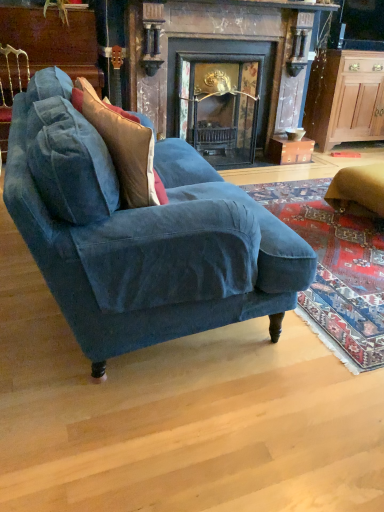
The width and height of the screenshot is (384, 512). What do you see at coordinates (221, 70) in the screenshot? I see `dark wood fireplace at center` at bounding box center [221, 70].

Locate an element on the screen. This screenshot has height=512, width=384. dark wood fireplace at center is located at coordinates (221, 70).

This screenshot has height=512, width=384. What do you see at coordinates (123, 147) in the screenshot?
I see `velvet cushion at left` at bounding box center [123, 147].

In order to face velvet blue couch at center, should I rotate leftwards or rightwards?

You should rotate left by 7.170 degrees.

What is the approximate width of velvet blue armchair at upper left?

It is 16.53 inches.

The width and height of the screenshot is (384, 512). Find the location of `velvet blue armchair at upper left`. velvet blue armchair at upper left is located at coordinates (10, 92).

Locate an element on the screen. The image size is (384, 512). dark wood fireplace at center is located at coordinates (221, 70).

Would you say velvet blue armchair at upper left is part of wooden cabinet at right's contents?

Definitely not — velvet blue armchair at upper left is not inside wooden cabinet at right.

From the picture: Can you confirm if wooden cabinet at right is positioned to the right of velvet blue armchair at upper left?

Correct, you'll find wooden cabinet at right to the right of velvet blue armchair at upper left.

Is wooden cabinet at right thinner than velvet blue armchair at upper left?

In fact, wooden cabinet at right might be wider than velvet blue armchair at upper left.

The width and height of the screenshot is (384, 512). I want to click on chair on the left of wooden cabinet at right, so click(x=10, y=92).

Considering the sizes of objects velvet cushion at left and velvet blue armchair at upper left in the image provided, who is bigger, velvet cushion at left or velvet blue armchair at upper left?

Bigger between the two is velvet blue armchair at upper left.

Could velvet blue armchair at upper left be considered to be inside velvet cushion at left?

No.

Is velvet blue armchair at upper left at the back of velvet cushion at left?

No, velvet cushion at left's orientation is not away from velvet blue armchair at upper left.

Which is behind, velvet cushion at left or dark wood fireplace at center?

Positioned behind is dark wood fireplace at center.

From the image's perspective, which object appears higher, velvet cushion at left or dark wood fireplace at center?

dark wood fireplace at center appears higher in the image.

Is velvet cushion at left positioned far away from dark wood fireplace at center?

Yes, velvet cushion at left and dark wood fireplace at center are located far from each other.

From a real-world perspective, does velvet cushion at left stand above dark wood fireplace at center?

Indeed, from a real-world perspective, velvet cushion at left stands above dark wood fireplace at center.

Is velvet blue armchair at upper left behind velvet cushion at left?

That is True.

From a real-world perspective, which is physically above, velvet blue armchair at upper left or velvet cushion at left?

From a 3D spatial view, velvet cushion at left is above.

In the scene shown: Does velvet blue armchair at upper left have a greater width compared to velvet cushion at left?

Correct, the width of velvet blue armchair at upper left exceeds that of velvet cushion at left.

From the image's perspective, does velvet blue armchair at upper left appear lower than dark wood fireplace at center?

Correct, velvet blue armchair at upper left appears lower than dark wood fireplace at center in the image.

From a real-world perspective, between velvet blue armchair at upper left and dark wood fireplace at center, who is vertically higher?

dark wood fireplace at center.

Consider the image. Is velvet blue armchair at upper left situated inside dark wood fireplace at center or outside?

velvet blue armchair at upper left cannot be found inside dark wood fireplace at center.

Is point (28, 62) farther from camera compared to point (191, 113)?

No, (28, 62) is in front of (191, 113).

Does point (21, 131) come behind point (3, 140)?

That is False.

Locate an element on the screen. Image resolution: width=384 pixels, height=512 pixels. chair behind the velvet blue couch at center is located at coordinates (10, 92).

From the picture: How different are the orientations of velvet blue couch at center and velvet blue armchair at upper left in degrees?

The angle between the facing direction of velvet blue couch at center and the facing direction of velvet blue armchair at upper left is 88.4 degrees.

Who is shorter, velvet blue couch at center or velvet blue armchair at upper left?

velvet blue armchair at upper left.

From the picture: Considering the relative sizes of wooden cabinet at right and velvet blue couch at center in the image provided, is wooden cabinet at right bigger than velvet blue couch at center?

Incorrect, wooden cabinet at right is not larger than velvet blue couch at center.

Is wooden cabinet at right to the left or to the right of velvet blue couch at center in the image?

From the image, it's evident that wooden cabinet at right is to the right of velvet blue couch at center.

Is wooden cabinet at right wider than velvet blue couch at center?

In fact, wooden cabinet at right might be narrower than velvet blue couch at center.

The height and width of the screenshot is (512, 384). I want to click on cabinetry that is above the velvet blue armchair at upper left (from the image's perspective), so click(x=345, y=98).

Where is `chair lying behind the velvet cushion at left`? chair lying behind the velvet cushion at left is located at coordinates (10, 92).

When comparing their distances from dark wood fireplace at center, does velvet blue armchair at upper left or wooden cabinet at right seem further?

velvet blue armchair at upper left is further to dark wood fireplace at center.

Based on the photo, which object lies nearer to the anchor point wooden cabinet at right, velvet blue couch at center or dark wood fireplace at center?

dark wood fireplace at center is closer to wooden cabinet at right.

From the image, which object appears to be farther from velvet blue couch at center, wooden cabinet at right or dark wood fireplace at center?

wooden cabinet at right is positioned further to the anchor velvet blue couch at center.

When comparing their distances from wooden cabinet at right, does velvet cushion at left or velvet blue couch at center seem closer?

Based on the image, velvet blue couch at center appears to be nearer to wooden cabinet at right.

Considering their positions, is velvet cushion at left positioned further to dark wood fireplace at center than wooden cabinet at right?

Among the two, velvet cushion at left is located further to dark wood fireplace at center.

Estimate the real-world distances between objects in this image. Which object is closer to wooden cabinet at right, velvet blue couch at center or velvet blue armchair at upper left?

velvet blue couch at center lies closer to wooden cabinet at right than the other object.

Consider the image. When comparing their distances from velvet cushion at left, does velvet blue armchair at upper left or dark wood fireplace at center seem further?

dark wood fireplace at center is further to velvet cushion at left.

When comparing their distances from wooden cabinet at right, does dark wood fireplace at center or velvet cushion at left seem further?

Among the two, velvet cushion at left is located further to wooden cabinet at right.

In order to click on throw pillow between velvet blue couch at center and wooden cabinet at right from front to back in this screenshot , I will do `click(123, 147)`.

Where is `throw pillow located between velvet blue armchair at upper left and wooden cabinet at right in the left-right direction`? Image resolution: width=384 pixels, height=512 pixels. throw pillow located between velvet blue armchair at upper left and wooden cabinet at right in the left-right direction is located at coordinates (123, 147).

The image size is (384, 512). I want to click on fireplace between velvet blue armchair at upper left and wooden cabinet at right in the horizontal direction, so click(x=221, y=70).

Find the location of a particular element. throw pillow located between velvet blue couch at center and velvet blue armchair at upper left in the depth direction is located at coordinates (123, 147).